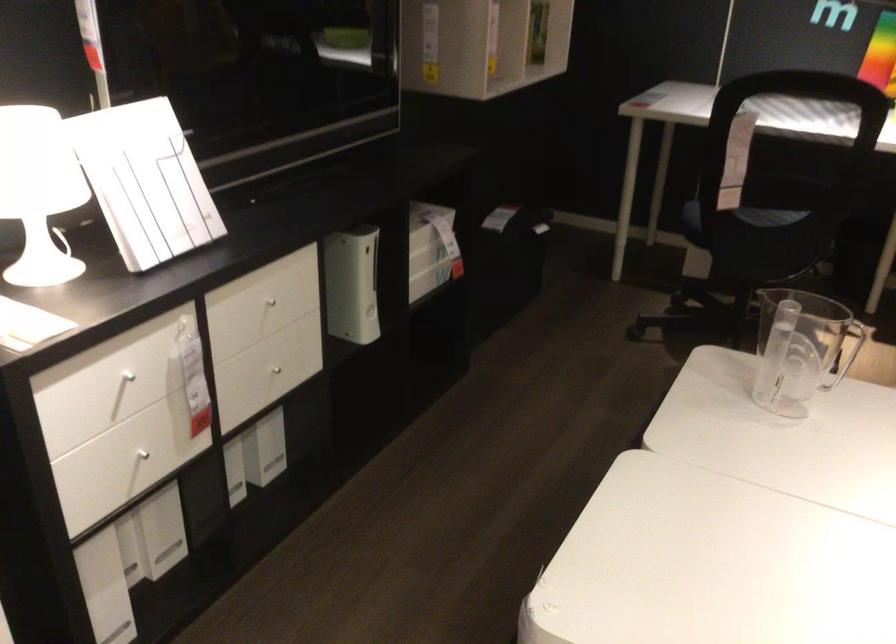
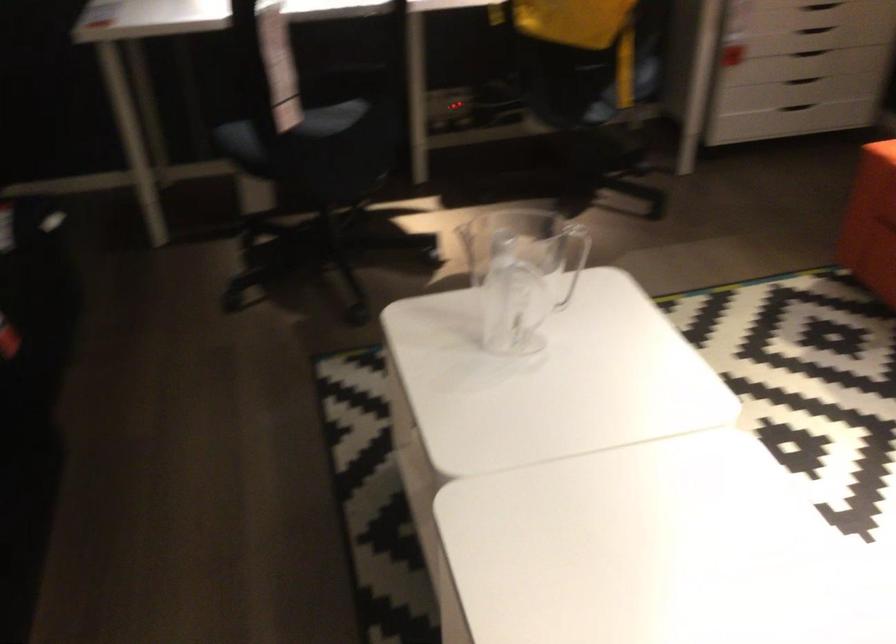
Question: The images are taken continuously from a first-person perspective. In which direction is your viewpoint rotating?

Choices:
 (A) Left
 (B) Right
 (C) Up
 (D) Down

Answer: (B)